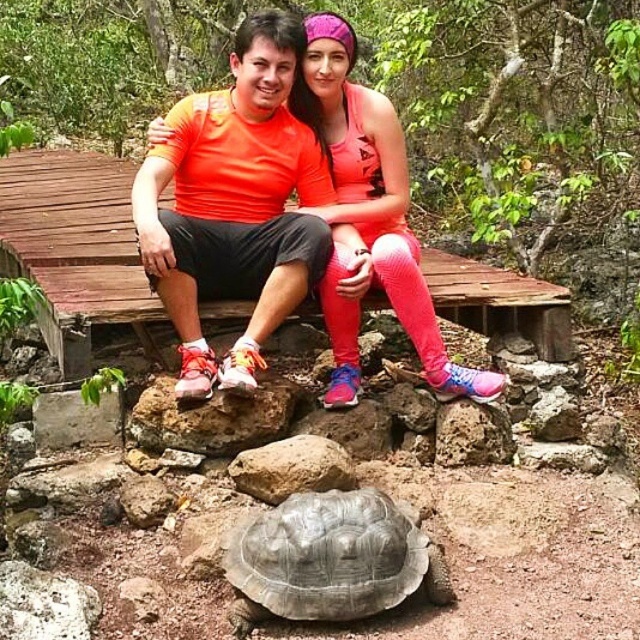
You are a photographer trying to capture both the orange matte shirt at center and the gray textured tortoise at lower center in a single frame. Which object should you focus on first to ensure both are in the frame?

The orange matte shirt at center is larger in size than the gray textured tortoise at lower center, so you should focus on the orange matte shirt at center first to ensure both fit within the frame.

You are a photographer standing at the edge of the platform. You want to take a photo that includes both the orange matte shirt at center and the gray textured tortoise at lower center. Can you fit both subjects into the frame if your camera has a 5 foot wide field of view?

The orange matte shirt at center and the gray textured tortoise at lower center are 3.35 feet apart. Since the distance between them is less than the camera field of view of 5 feet, both subjects can be captured in the same frame.

You are a photographer positioned at the edge of the platform and want to capture a photo of both the orange matte shirt at center and the gray textured tortoise at lower center. Which object should you focus on first to ensure both are in sharp focus?

You should focus on the orange matte shirt at center first since it is closer to you than the gray textured tortoise at lower center, ensuring both will be in focus when using depth of field appropriately.